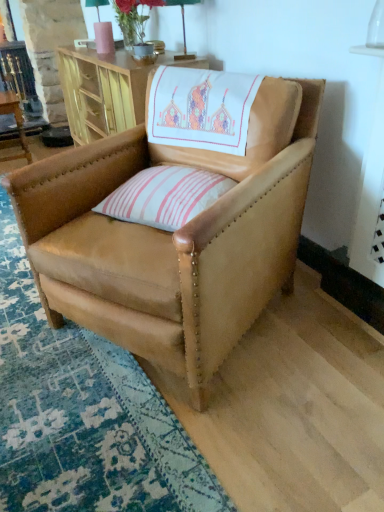
Question: Considering the relative sizes of wooden table at left, the 1th table from the left, and pink striped cushion at center in the image provided, is wooden table at left, the 1th table from the left, shorter than pink striped cushion at center?

Choices:
 (A) yes
 (B) no

Answer: (B)

Question: Considering the relative sizes of wooden table at left, the 1th table from the left, and pink striped cushion at center in the image provided, is wooden table at left, the 1th table from the left, thinner than pink striped cushion at center?

Choices:
 (A) yes
 (B) no

Answer: (A)

Question: Is wooden table at left, arranged as the second table when viewed from the right, to the left of pink striped cushion at center from the viewer's perspective?

Choices:
 (A) no
 (B) yes

Answer: (B)

Question: Is wooden table at left, the 1th table from the left, directly adjacent to pink striped cushion at center?

Choices:
 (A) no
 (B) yes

Answer: (A)

Question: From a real-world perspective, is wooden table at left, arranged as the second table when viewed from the right, physically below pink striped cushion at center?

Choices:
 (A) no
 (B) yes

Answer: (B)

Question: Is the position of wooden table at left, arranged as the second table when viewed from the right, more distant than that of pink striped cushion at center?

Choices:
 (A) no
 (B) yes

Answer: (B)

Question: Is wooden cabinet at upper center, which is the second table from left to right, turned away from tan leather chair at center?

Choices:
 (A) yes
 (B) no

Answer: (B)

Question: Does wooden cabinet at upper center, which is the second table from left to right, have a lesser height compared to tan leather chair at center?

Choices:
 (A) yes
 (B) no

Answer: (A)

Question: Does wooden cabinet at upper center, the 1th table when ordered from right to left, turn towards tan leather chair at center?

Choices:
 (A) no
 (B) yes

Answer: (A)

Question: Does wooden cabinet at upper center, which is the second table from left to right, touch tan leather chair at center?

Choices:
 (A) no
 (B) yes

Answer: (A)

Question: From a real-world perspective, is wooden cabinet at upper center, which is the second table from left to right, physically below tan leather chair at center?

Choices:
 (A) yes
 (B) no

Answer: (B)

Question: Is wooden cabinet at upper center, which is the second table from left to right, not near tan leather chair at center?

Choices:
 (A) no
 (B) yes

Answer: (A)

Question: Is matte pink vase at upper center further to camera compared to pink striped cushion at center?

Choices:
 (A) no
 (B) yes

Answer: (B)